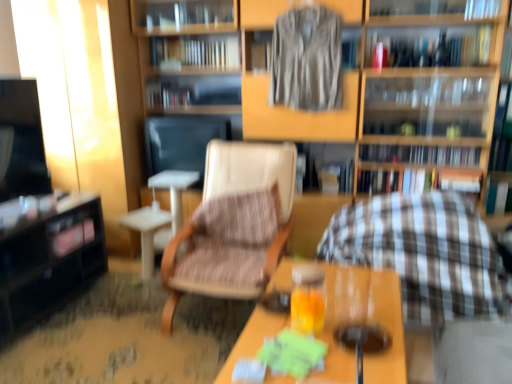
Locate an element on the screen. blank space above wooden table at center, the 1th table viewed from the right (from a real-world perspective) is located at coordinates (335, 315).